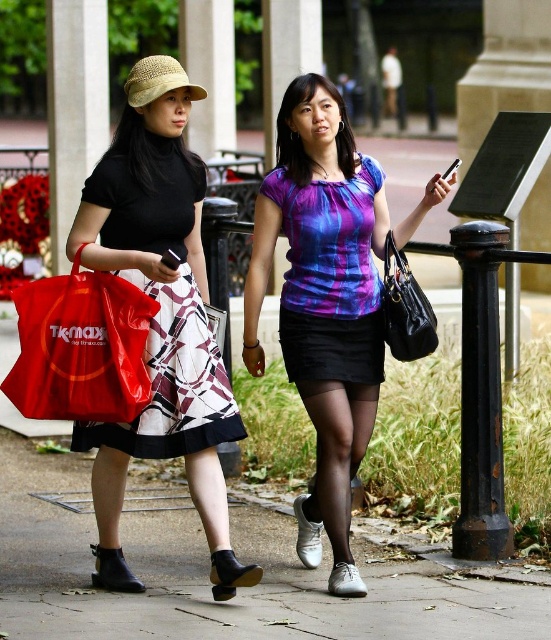
In the scene shown: Can you confirm if concrete sidewalk at center is taller than purple tie-dye blouse at center?

Incorrect, concrete sidewalk at center's height is not larger of purple tie-dye blouse at center's.

Can you confirm if concrete sidewalk at center is positioned below purple tie-dye blouse at center?

Indeed, concrete sidewalk at center is positioned under purple tie-dye blouse at center.

Measure the distance between concrete sidewalk at center and camera.

concrete sidewalk at center and camera are 26.43 feet apart from each other.

At what (x,y) coordinates should I click in order to perform the action: click on concrete sidewalk at center. Please return your answer as a coordinate pair (x, y). The height and width of the screenshot is (640, 551). Looking at the image, I should click on (207, 579).

What do you see at coordinates (406, 308) in the screenshot? I see `black leather handbag at right` at bounding box center [406, 308].

Is black leather handbag at right above straw hat at upper left?

Actually, black leather handbag at right is below straw hat at upper left.

Who is more distant from viewer, (x=433, y=330) or (x=185, y=81)?

The point (x=433, y=330) is behind.

Identify the location of black leather handbag at right. Image resolution: width=551 pixels, height=640 pixels. (406, 308).

Which is more to the right, shiny purple fabric dress at center or black leather handbag at right?

black leather handbag at right is more to the right.

Between point (331, 324) and point (396, 330), which one is positioned behind?

Positioned behind is point (331, 324).

Find the location of a particular element. shiny purple fabric dress at center is located at coordinates (329, 276).